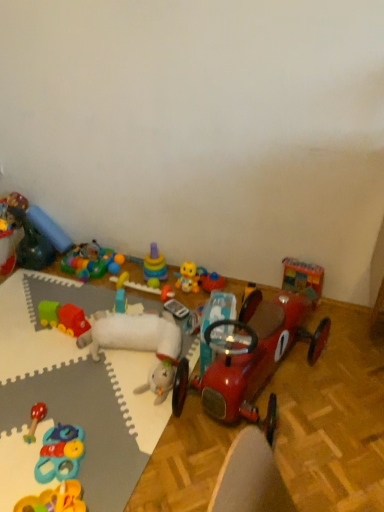
This screenshot has width=384, height=512. What are the coordinates of `vacant area on top of white foam mat at lower left (from a real-world perspective)` in the screenshot? It's located at (62, 375).